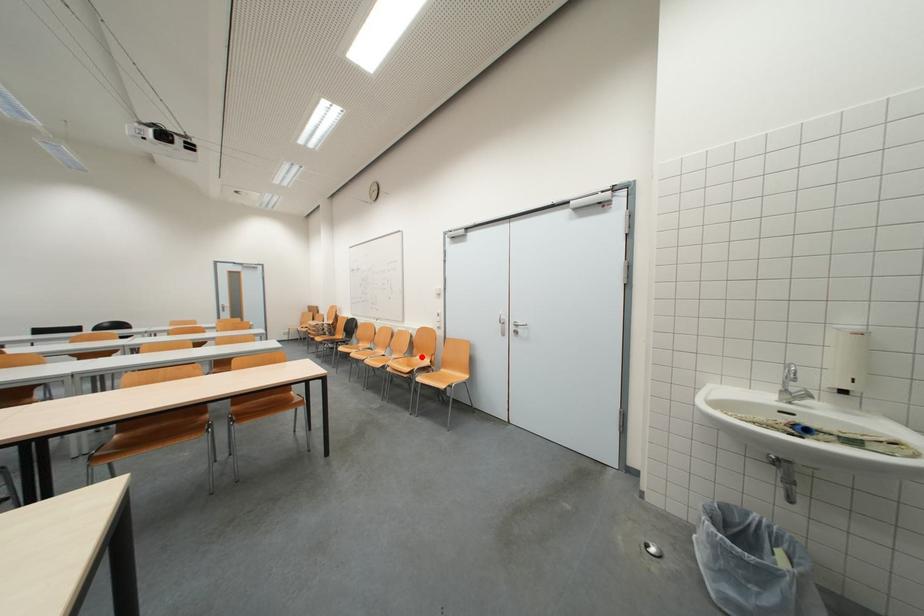
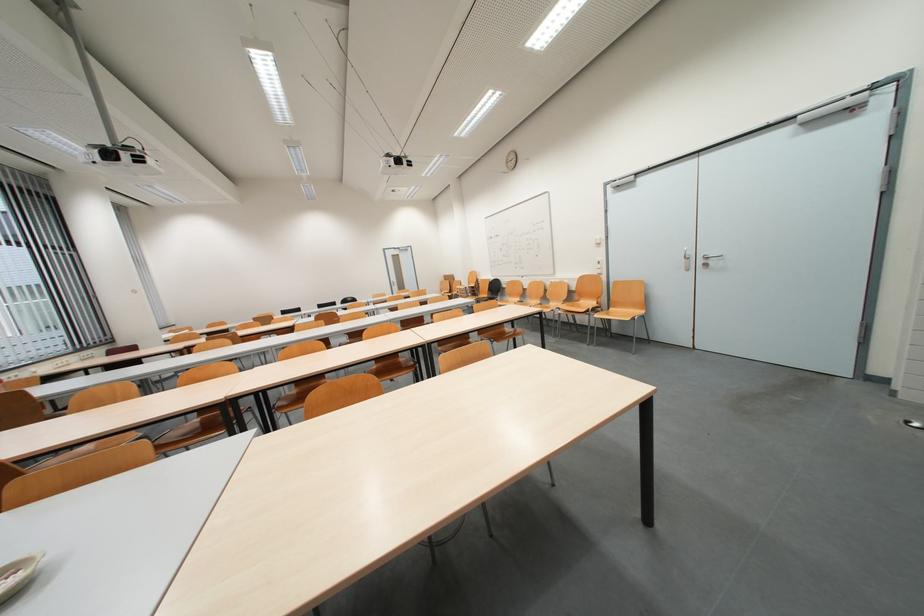
Where in the second image is the point corresponding to the highlighted location from the first image?

(582, 302)